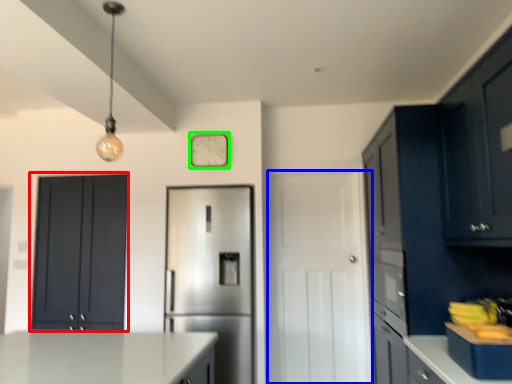
Question: Which object is positioned farthest from cabinetry (highlighted by a red box)? Select from door (highlighted by a blue box) and clock (highlighted by a green box).

Choices:
 (A) door
 (B) clock

Answer: (A)